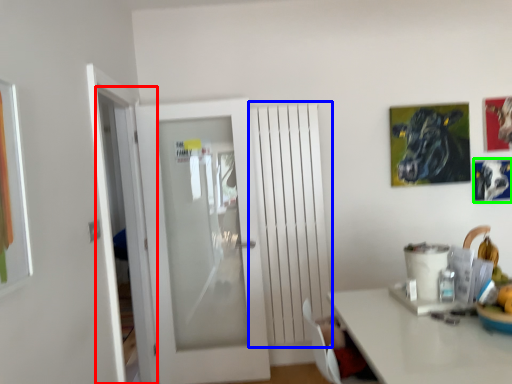
Question: Based on their relative distances, which object is nearer to screen door (highlighted by a red box)? Choose from radiator (highlighted by a blue box) and picture frame (highlighted by a green box).

Choices:
 (A) radiator
 (B) picture frame

Answer: (A)